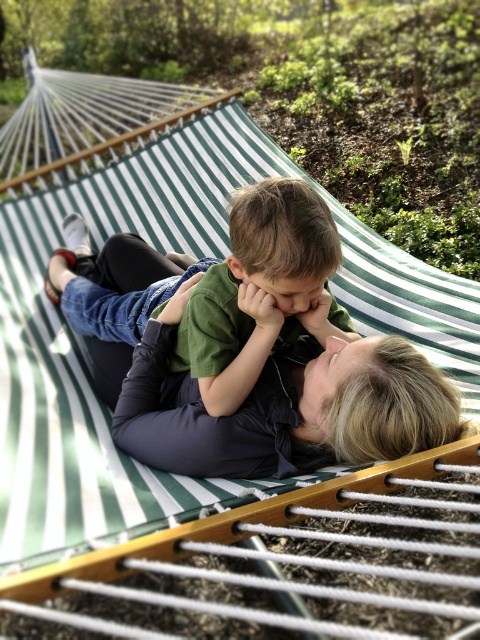
Question: Does matte black pants at center have a larger size compared to green matte shirt at center?

Choices:
 (A) no
 (B) yes

Answer: (A)

Question: Is matte black pants at center to the left of green matte shirt at center from the viewer's perspective?

Choices:
 (A) yes
 (B) no

Answer: (B)

Question: Does matte black pants at center appear on the left side of green matte shirt at center?

Choices:
 (A) yes
 (B) no

Answer: (B)

Question: Which point is closer to the camera?

Choices:
 (A) (324, 448)
 (B) (202, 378)

Answer: (A)

Question: Which of the following is the closest to the observer?

Choices:
 (A) matte black pants at center
 (B) green matte shirt at center

Answer: (A)

Question: Which point is closer to the camera taking this photo?

Choices:
 (A) (314, 355)
 (B) (324, 323)

Answer: (B)